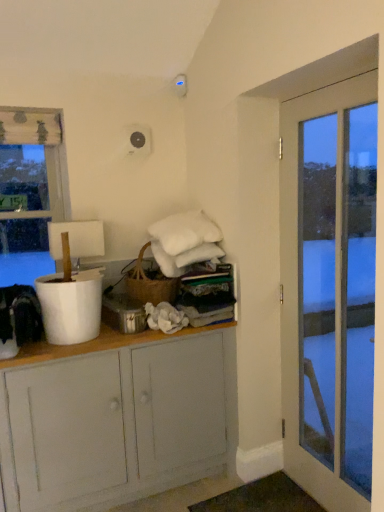
Question: Is white glass door at right looking in the opposite direction of transparent glass window at left?

Choices:
 (A) yes
 (B) no

Answer: (B)

Question: Is white glass door at right located outside transparent glass window at left?

Choices:
 (A) no
 (B) yes

Answer: (B)

Question: Considering the relative sizes of white glass door at right and transparent glass window at left in the image provided, is white glass door at right thinner than transparent glass window at left?

Choices:
 (A) yes
 (B) no

Answer: (B)

Question: Does white glass door at right turn towards transparent glass window at left?

Choices:
 (A) yes
 (B) no

Answer: (B)

Question: Considering the relative sizes of white glass door at right and transparent glass window at left in the image provided, is white glass door at right wider than transparent glass window at left?

Choices:
 (A) yes
 (B) no

Answer: (A)

Question: Is white glass door at right positioned far away from transparent glass window at left?

Choices:
 (A) yes
 (B) no

Answer: (A)

Question: Is transparent glass window at left shorter than white painted wood cabinet at center?

Choices:
 (A) no
 (B) yes

Answer: (A)

Question: Does transparent glass window at left have a lesser width compared to white painted wood cabinet at center?

Choices:
 (A) no
 (B) yes

Answer: (B)

Question: From the image's perspective, is transparent glass window at left located above white painted wood cabinet at center?

Choices:
 (A) no
 (B) yes

Answer: (B)

Question: Does transparent glass window at left come in front of white painted wood cabinet at center?

Choices:
 (A) yes
 (B) no

Answer: (B)

Question: Is transparent glass window at left outside of white painted wood cabinet at center?

Choices:
 (A) no
 (B) yes

Answer: (B)

Question: From a real-world perspective, does transparent glass window at left stand above white painted wood cabinet at center?

Choices:
 (A) yes
 (B) no

Answer: (A)

Question: Considering the relative sizes of white glass door at right and white painted wood cabinet at center in the image provided, is white glass door at right smaller than white painted wood cabinet at center?

Choices:
 (A) yes
 (B) no

Answer: (A)